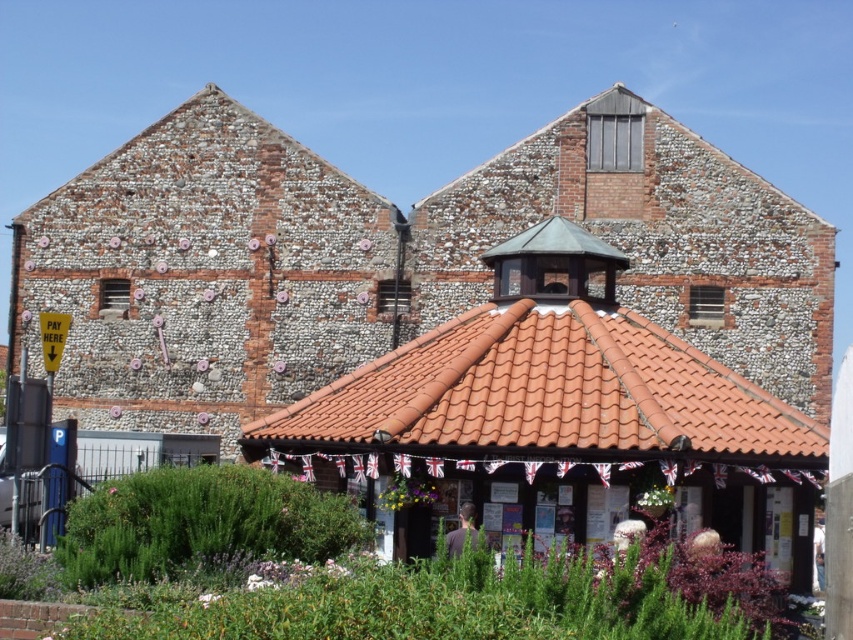
Does brown tiled gazebo at center lie in front of terracotta tiles at center?

No, brown tiled gazebo at center is behind terracotta tiles at center.

Does point (469, 314) lie behind point (440, 330)?

Yes, point (469, 314) is behind point (440, 330).

Find the location of `brown tiled gazebo at center`. brown tiled gazebo at center is located at coordinates (560, 419).